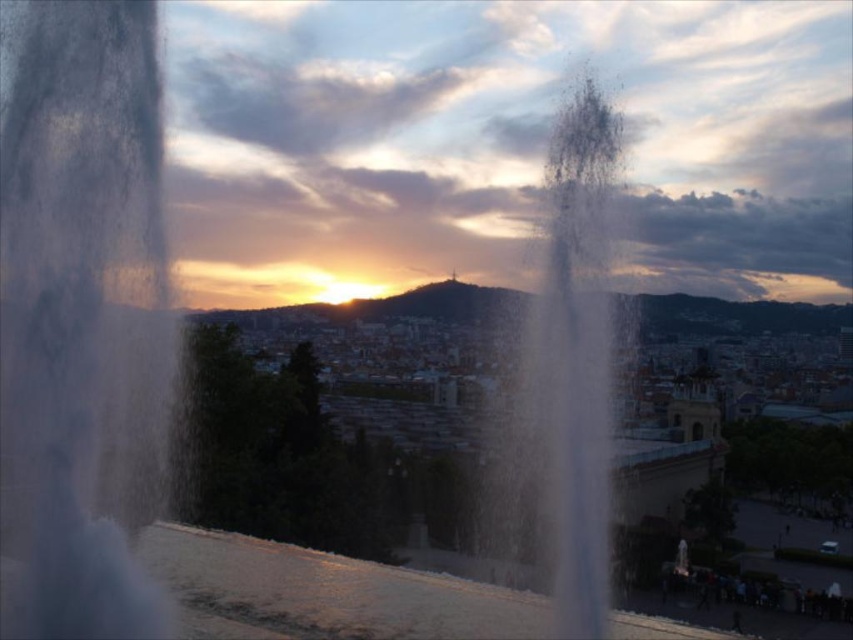
You are a photographer trying to capture the sunset through the water and mist at the center of the scene. Since both the transparent water at center and transparent mist at center are in your frame, which one allows more light to pass through for a clearer photo?

The transparent water at center is thinner than transparent mist at center, so the transparent water at center allows more light to pass through, making it better for a clearer photo.

You are a photographer aiming to capture the sunset through the water and mist in the center. Which object, the transparent water at center or the transparent mist at center, will appear closer to your camera lens?

The transparent water at center is in front of the transparent mist at center, so the transparent water at center will appear closer to your camera lens.

You are standing in the city park observing the sunset. You notice two points in the image, one at coordinates point (x=38, y=346) and another at point (x=577, y=600). Which point is closer to you, the observer?

Point (x=38, y=346) is in front of point (x=577, y=600), so it is closer to you.